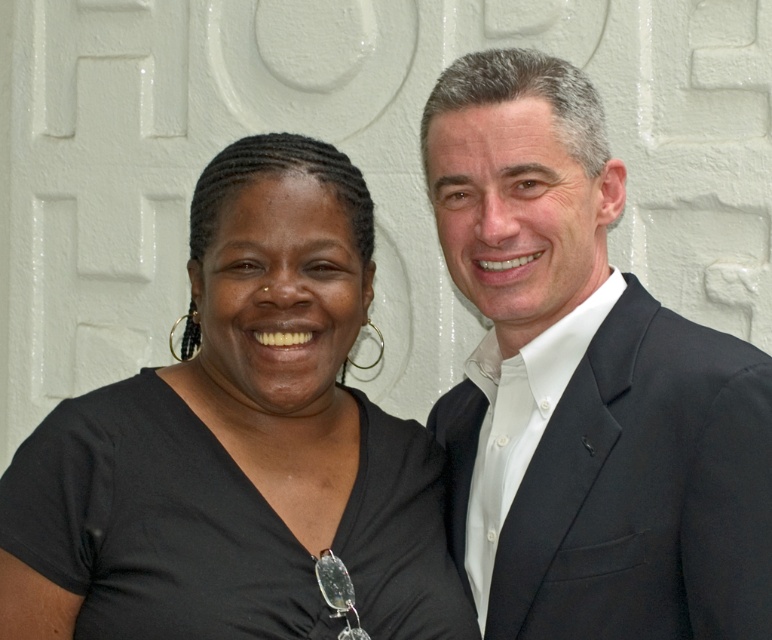
Can you confirm if black matte shirt at left is thinner than black suit at right?

No.

Between black matte shirt at left and black suit at right, which one is positioned higher?

black suit at right is higher up.

Who is more forward, (119,493) or (679,497)?

Point (679,497)

Find the location of a particular element. The image size is (772, 640). black matte shirt at left is located at coordinates (239, 444).